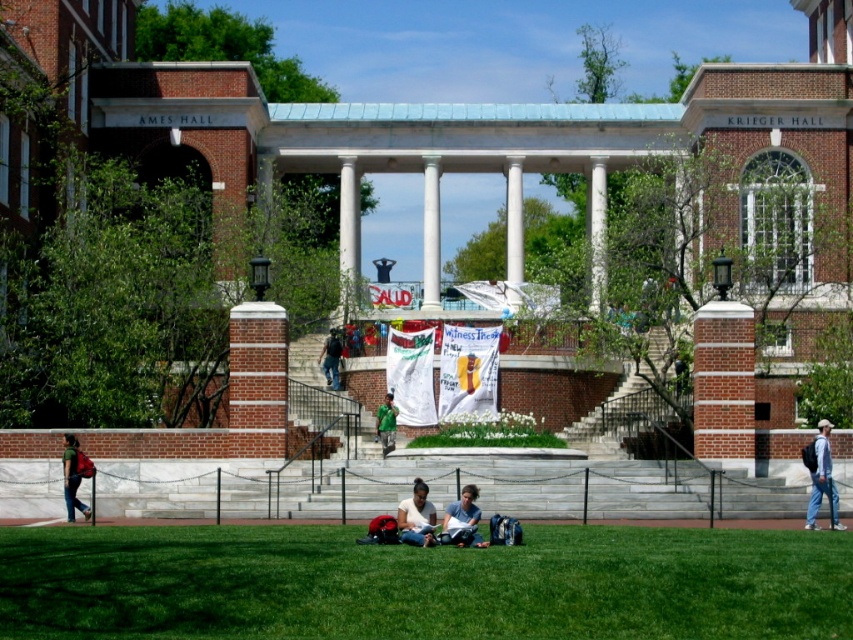
Where is `blue jeans at lower right`? This screenshot has height=640, width=853. blue jeans at lower right is located at coordinates (820, 476).

Who is higher up, blue jeans at lower right or matte blue jeans at center?

blue jeans at lower right

Which is behind, point (817, 497) or point (451, 529)?

Point (817, 497)

Locate an element on the screen. blue jeans at lower right is located at coordinates (820, 476).

Can you confirm if matte black backpack at lower center is positioned below matte red backpack at lower left?

No.

Is matte black backpack at lower center to the left of matte red backpack at lower left from the viewer's perspective?

Incorrect, matte black backpack at lower center is not on the left side of matte red backpack at lower left.

What do you see at coordinates (416, 516) in the screenshot?
I see `matte black backpack at lower center` at bounding box center [416, 516].

Where is `matte black backpack at lower center`? matte black backpack at lower center is located at coordinates (416, 516).

Does matte blue jeans at center appear on the left side of matte red backpack at lower left?

No, matte blue jeans at center is not to the left of matte red backpack at lower left.

Is point (474, 531) in front of point (79, 500)?

Yes, point (474, 531) is in front of point (79, 500).

I want to click on matte blue jeans at center, so click(462, 518).